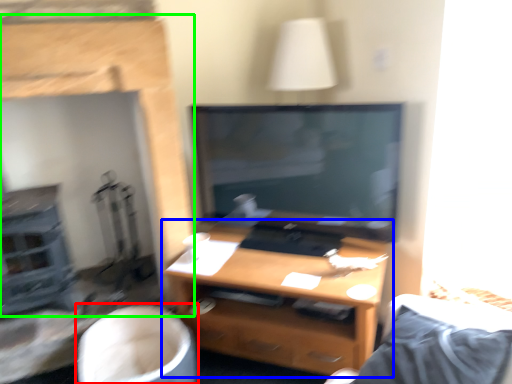
Question: Which object is positioned farthest from swivel chair (highlighted by a red box)? Select from desk (highlighted by a blue box) and fireplace (highlighted by a green box).

Choices:
 (A) desk
 (B) fireplace

Answer: (B)